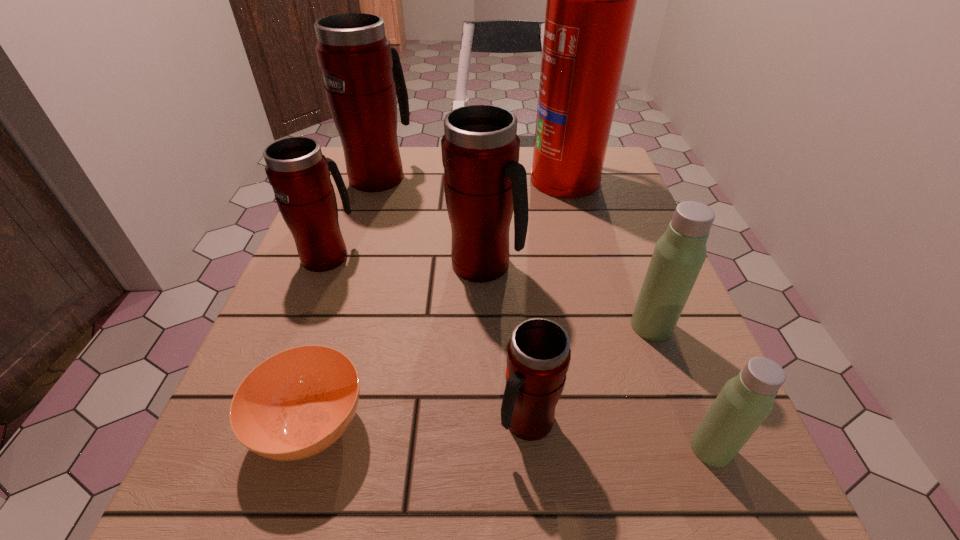
Where is `the tallest object`? The width and height of the screenshot is (960, 540). the tallest object is located at coordinates (591, 0).

Identify the location of red fire extinguisher. (591, 0).

At what (x,y) coordinates should I click in order to perform the action: click on the second tallest object. Please return your answer as a coordinate pair (x, y). The height and width of the screenshot is (540, 960). Looking at the image, I should click on (362, 72).

Image resolution: width=960 pixels, height=540 pixels. In order to click on the biggest red thermos bottle in this screenshot , I will do click(362, 72).

Image resolution: width=960 pixels, height=540 pixels. Identify the location of the second tallest thermos bottle. (484, 182).

The image size is (960, 540). I want to click on the sixth shortest object, so click(484, 182).

Find the location of a particular element. This screenshot has height=540, width=960. the bigger light thermos bottle is located at coordinates 679,254.

This screenshot has width=960, height=540. What are the coordinates of `the farther light thermos bottle` in the screenshot? It's located at 679,254.

Identify the location of the second smallest red thermos bottle. This screenshot has width=960, height=540. coord(299,173).

Identify the location of the nearest red thermos bottle. (538, 355).